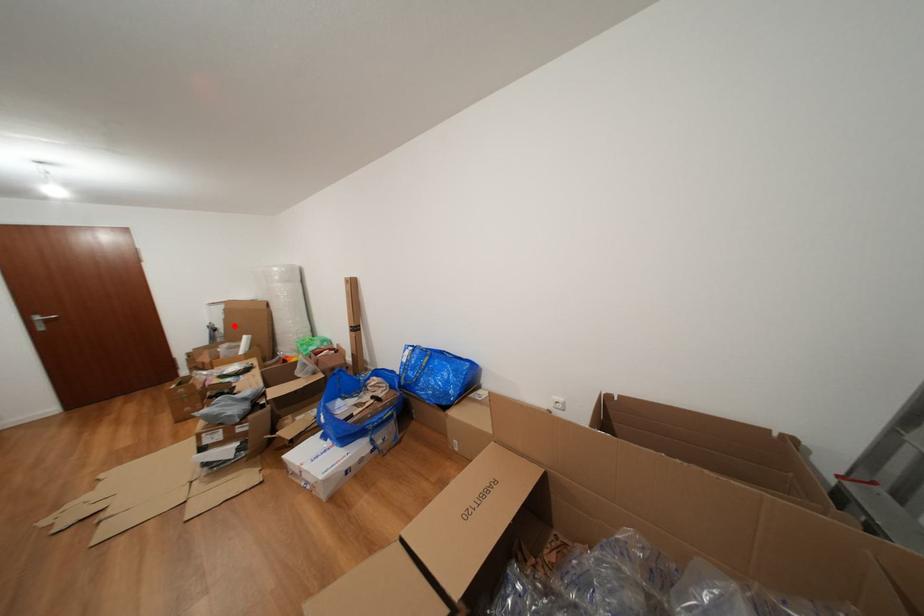
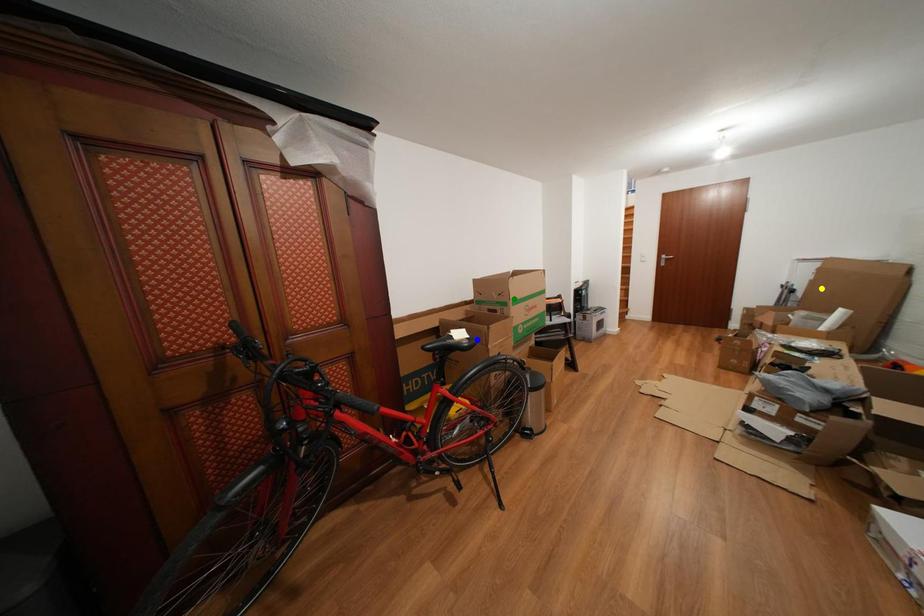
Question: I am providing you with two images of the same scene from different viewpoints. A red point is marked on the first image. You are given multiple points on the second image. Which point in image 2 represents the same 3d spot as the red point in image 1?

Choices:
 (A) blue point
 (B) yellow point
 (C) green point

Answer: (B)